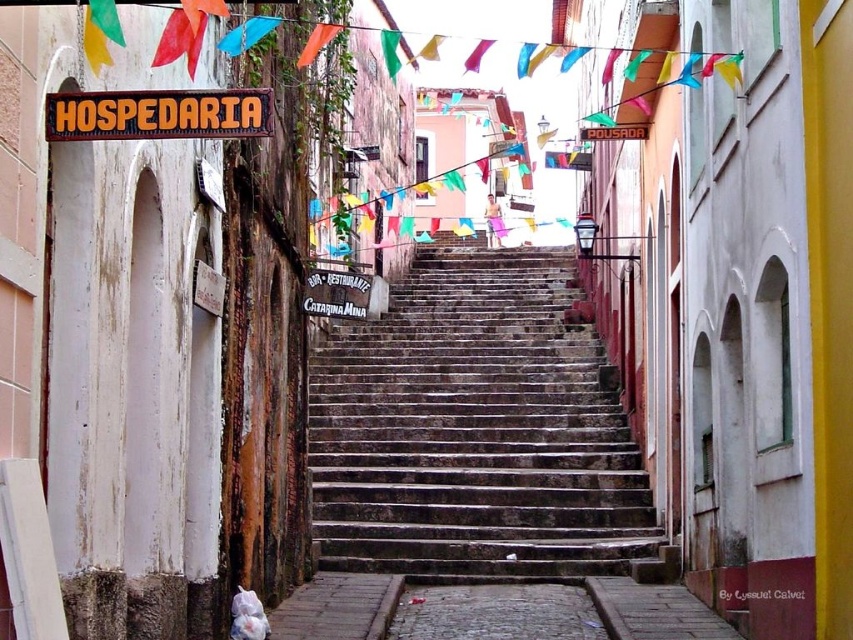
You are a tourist standing at the bottom of the staircase and want to find the restaurant Catarina Mina. You see the orange wood sign at upper center and the orange fabric flag at upper center. Which one is located to the left side of the other?

The orange wood sign at upper center is located to the left of the orange fabric flag at upper center.

You are a tourist standing at the bottom of the staircase and want to read both the orange wood sign at upper center and the orange fabric flag at upper center. Which one should you look at first to read the lodging establishment name?

The orange wood sign at upper center is located below the orange fabric flag at upper center, so you should look at the orange fabric flag at upper center first as it is higher up and likely contains the lodging establishment name.